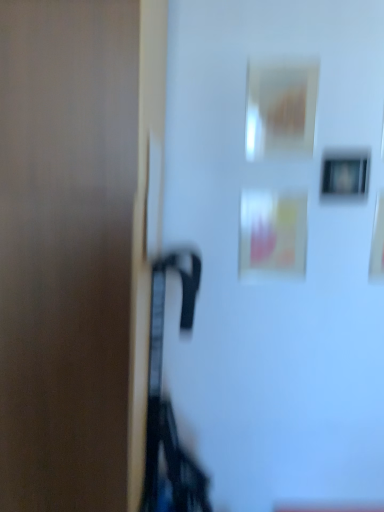
Question: Should I look upward or downward to see matte black picture frame at upper right?

Choices:
 (A) down
 (B) up

Answer: (B)

Question: Should I look upward or downward to see matte brown door at left?

Choices:
 (A) up
 (B) down

Answer: (B)

Question: Can you confirm if matte black picture frame at upper right is shorter than matte brown door at left?

Choices:
 (A) yes
 (B) no

Answer: (A)

Question: Does matte black picture frame at upper right appear on the left side of matte brown door at left?

Choices:
 (A) yes
 (B) no

Answer: (B)

Question: Can you confirm if matte black picture frame at upper right is thinner than matte brown door at left?

Choices:
 (A) no
 (B) yes

Answer: (B)

Question: Is matte black picture frame at upper right further to the viewer compared to matte brown door at left?

Choices:
 (A) yes
 (B) no

Answer: (A)

Question: From the image's perspective, is matte black picture frame at upper right located beneath matte brown door at left?

Choices:
 (A) yes
 (B) no

Answer: (B)

Question: Is matte brown door at left completely or partially inside matte black picture frame at upper right?

Choices:
 (A) no
 (B) yes

Answer: (A)

Question: Can you confirm if matte brown door at left is positioned to the right of matte black picture frame at upper right?

Choices:
 (A) no
 (B) yes

Answer: (A)

Question: Does matte brown door at left appear on the left side of matte black picture frame at upper right?

Choices:
 (A) no
 (B) yes

Answer: (B)

Question: Is matte black picture frame at upper right at the back of matte brown door at left?

Choices:
 (A) yes
 (B) no

Answer: (B)

Question: Is matte brown door at left facing towards matte black picture frame at upper right?

Choices:
 (A) no
 (B) yes

Answer: (A)

Question: From a real-world perspective, is matte brown door at left positioned under matte black picture frame at upper right based on gravity?

Choices:
 (A) no
 (B) yes

Answer: (B)

Question: Are matte brown door at left and matte black picture frame at upper right making contact?

Choices:
 (A) yes
 (B) no

Answer: (B)

Question: From their relative heights in the image, would you say matte brown door at left is taller or shorter than matte black picture frame at upper right?

Choices:
 (A) tall
 (B) short

Answer: (A)